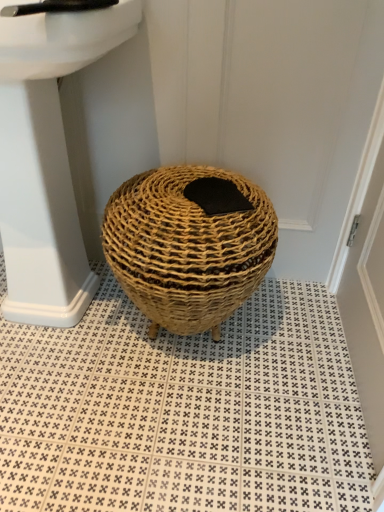
Find the location of a particular element. Image resolution: width=384 pixels, height=512 pixels. vacant region under natural woven basket at center (from a real-world perspective) is located at coordinates (187, 344).